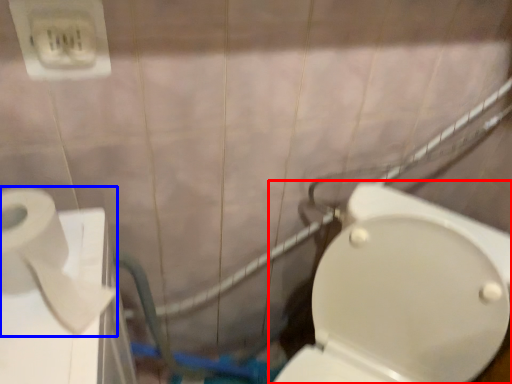
Question: Which object appears farthest to the camera in this image, toilet (highlighted by a red box) or toilet paper (highlighted by a blue box)?

Choices:
 (A) toilet
 (B) toilet paper

Answer: (B)